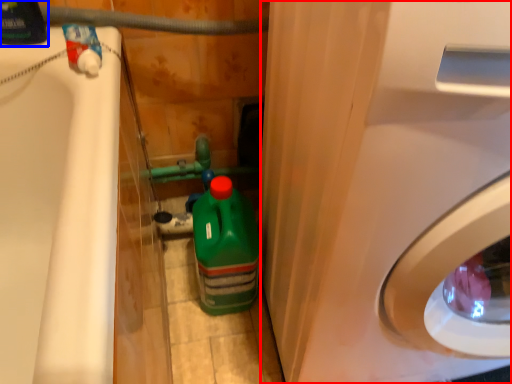
Question: Which of the following is the farthest to the observer, washing machine (highlighted by a red box) or cleaning product (highlighted by a blue box)?

Choices:
 (A) washing machine
 (B) cleaning product

Answer: (B)